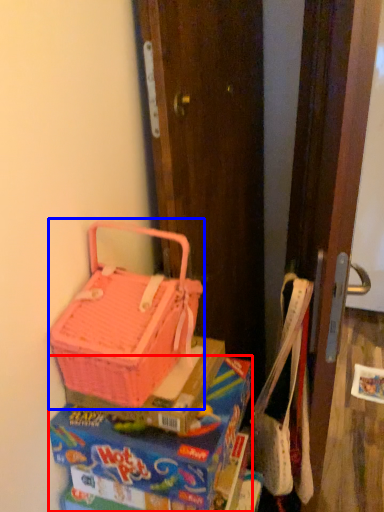
Question: Which of the following is the farthest to the observer, lunch box (highlighted by a red box) or picnic basket (highlighted by a blue box)?

Choices:
 (A) lunch box
 (B) picnic basket

Answer: (A)